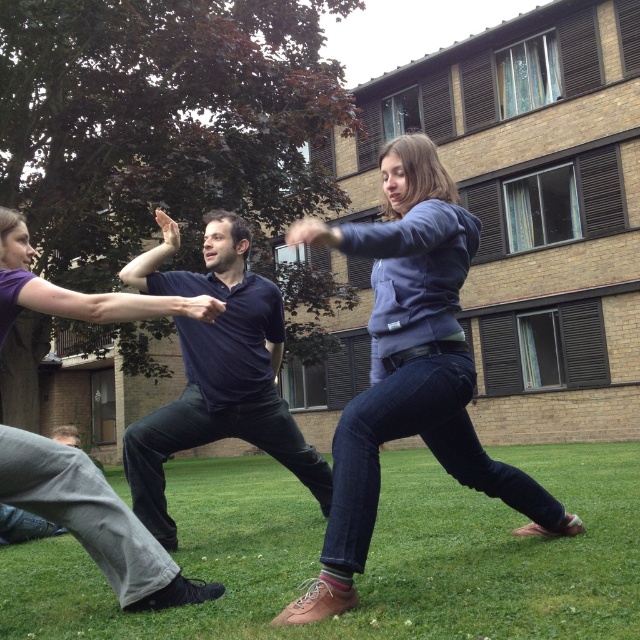
Between green grass at lower center and matte purple shirt at center, which one has more height?

green grass at lower center is taller.

Which is below, green grass at lower center or matte purple shirt at center?

Positioned lower is green grass at lower center.

The width and height of the screenshot is (640, 640). Describe the element at coordinates (368, 557) in the screenshot. I see `green grass at lower center` at that location.

In order to click on green grass at lower center in this screenshot , I will do `click(368, 557)`.

Who is positioned more to the right, green grass at lower center or dark blue shirt at center?

green grass at lower center

The height and width of the screenshot is (640, 640). Describe the element at coordinates (368, 557) in the screenshot. I see `green grass at lower center` at that location.

You are a GUI agent. You are given a task and a screenshot of the screen. Output one action in this format:
    pyautogui.click(x=<x>, y=<y>)
    Task: Click on the green grass at lower center
    The image size is (640, 640).
    Given the screenshot: What is the action you would take?
    pyautogui.click(x=368, y=557)

Can you confirm if matte blue hoodie at center is positioned above matte purple shirt at center?

Yes.

Does matte blue hoodie at center appear on the left side of matte purple shirt at center?

No, matte blue hoodie at center is not to the left of matte purple shirt at center.

Which is behind, point (372, 525) or point (17, 458)?

Positioned behind is point (372, 525).

The width and height of the screenshot is (640, 640). I want to click on matte blue hoodie at center, so (x=410, y=371).